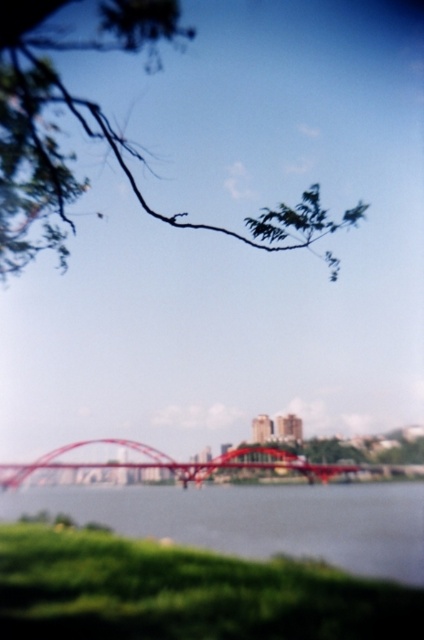
You are standing at the center of the modern red arch bridge and want to take a photo of the city buildings in the background without any obstructions. Is the green leafy branch at upper left blocking your view? Please explain based on its position.

The green leafy branch at upper left is located at point (97, 134), which is near the upper left corner of the frame. Since you are standing at the center of the bridge, this branch would be positioned off to the upper left side of your view, potentially partially obscuring the upper left portion of the city buildings. However, the main city buildings in the center background should remain visible. To avoid obstruction, you could adjust your position slightly to the right or lower your camera angle.

You are a photographer trying to capture the metallic red bridge at center without any obstructions. Given the position of the green leafy branch at upper left, can you determine if the branch will block the view of the bridge?

The green leafy branch at upper left is to the right of the metallic red bridge at center, so it might block part of the bridge if positioned in front of it. However, since the bridge is at the center and the branch is at the upper left, their positions might not overlap directly. Further details on depth or distance between them are needed to confirm obstruction.

You are standing at the point labeled point (318, 230) and want to take a photo of the modern red arch bridge. Since the camera is 70.52 meters away from you, will the bridge be in focus? Please explain your reasoning.

The camera is 70.52 meters away from point (318, 230), so the bridge may not be in focus if the camera is focused on the foreground. However, the description does not provide information about the camera settings or focus distance. To ensure the bridge is in focus, adjust the focus to the distance of the bridge.